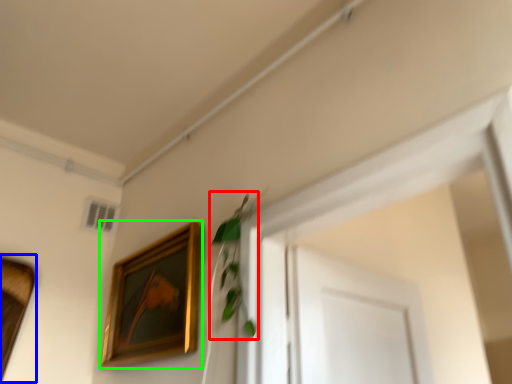
Question: Which is nearer to the plant (highlighted by a red box)? picture frame (highlighted by a blue box) or picture frame (highlighted by a green box).

Choices:
 (A) picture frame
 (B) picture frame

Answer: (B)